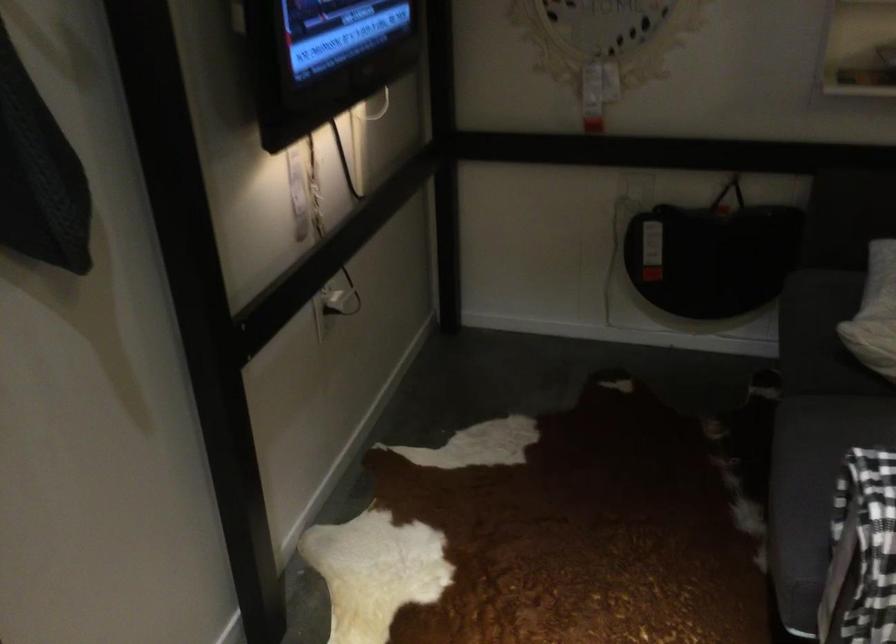
The location [334,304] corresponds to which object?

This point indicates the white power plug.